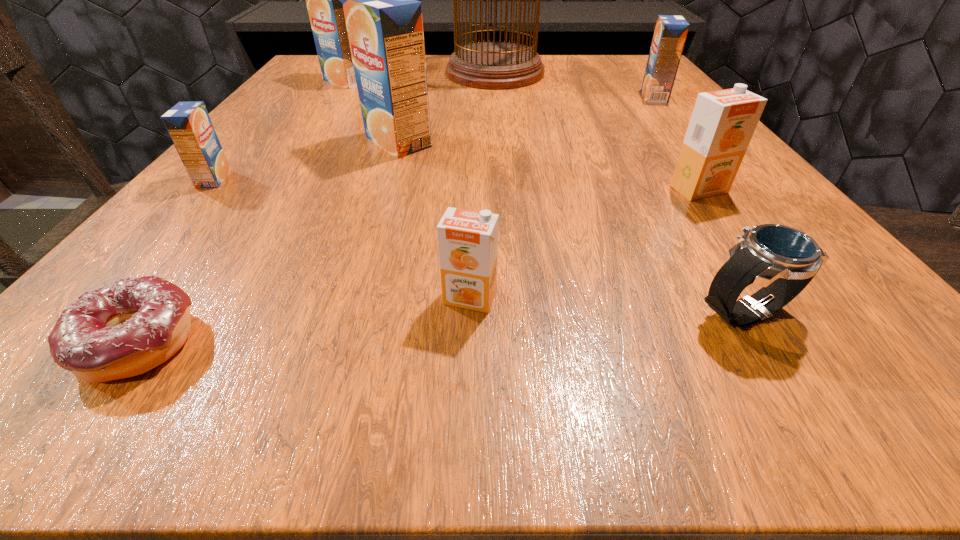
Find the location of a particular element. This screenshot has height=540, width=960. the nearest blue orange_juice is located at coordinates (189, 125).

Find the location of a particular element. The height and width of the screenshot is (540, 960). the smaller orange orange juice is located at coordinates (468, 240).

I want to click on the nearer orange orange juice, so click(468, 240).

Where is `watch`? This screenshot has height=540, width=960. watch is located at coordinates (783, 260).

The image size is (960, 540). I want to click on pink doughnut, so pyautogui.click(x=124, y=329).

Locate an element on the screen. The image size is (960, 540). doughnut is located at coordinates (124, 329).

The width and height of the screenshot is (960, 540). Identify the location of vacant space located 0.240m on the front-facing side of the tallest object. (345, 72).

This screenshot has width=960, height=540. I want to click on vacant space located 0.120m on the front-facing side of the tallest object, so click(x=396, y=72).

At what (x,y) coordinates should I click in order to perform the action: click on free region located on the front-facing side of the tallest object. Please return your answer as a coordinate pair (x, y). The width and height of the screenshot is (960, 540). Looking at the image, I should click on (310, 72).

Image resolution: width=960 pixels, height=540 pixels. I want to click on vacant space situated on the front of the sixth nearest object, so click(363, 256).